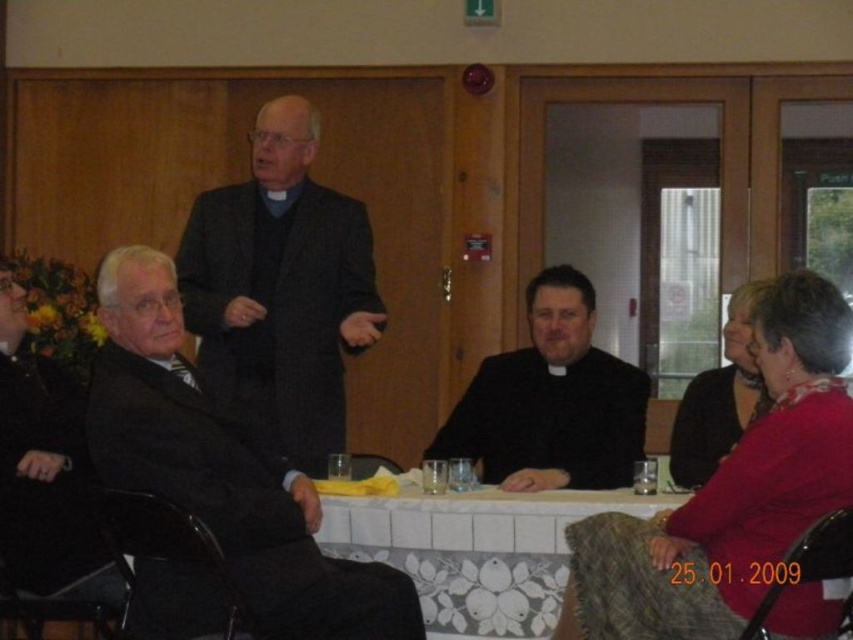
Question: Can you confirm if matte black suit at left is smaller than black matte suit at left?

Choices:
 (A) no
 (B) yes

Answer: (A)

Question: Does matte black suit at left have a lesser width compared to white floral tablecloth at center?

Choices:
 (A) yes
 (B) no

Answer: (A)

Question: Which point is closer to the camera?

Choices:
 (A) pyautogui.click(x=221, y=195)
 (B) pyautogui.click(x=448, y=438)
 (C) pyautogui.click(x=729, y=378)

Answer: (B)

Question: Is matte black suit at left wider than white floral tablecloth at center?

Choices:
 (A) no
 (B) yes

Answer: (A)

Question: Which point is closer to the camera?

Choices:
 (A) matte pink sweater at lower right
 (B) black matte suit at left
 (C) matte black suit at left
 (D) white floral tablecloth at center

Answer: (A)

Question: Which object is positioned farthest from the dark textured suit at center?

Choices:
 (A) white floral tablecloth at center
 (B) matte black suit at left
 (C) black matte suit at left
 (D) dark red sweater at lower right

Answer: (D)